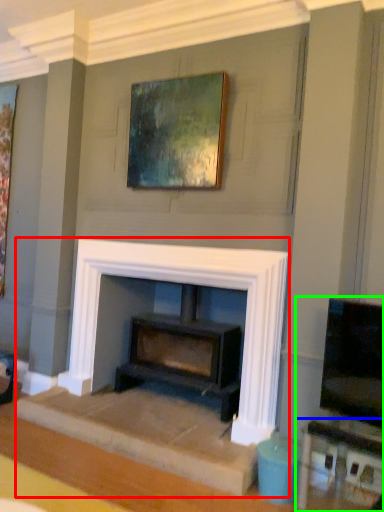
Question: Estimate the real-world distances between objects in this image. Which object is farther from fireplace (highlighted by a red box), table (highlighted by a blue box) or entertainment center (highlighted by a green box)?

Choices:
 (A) table
 (B) entertainment center

Answer: (A)